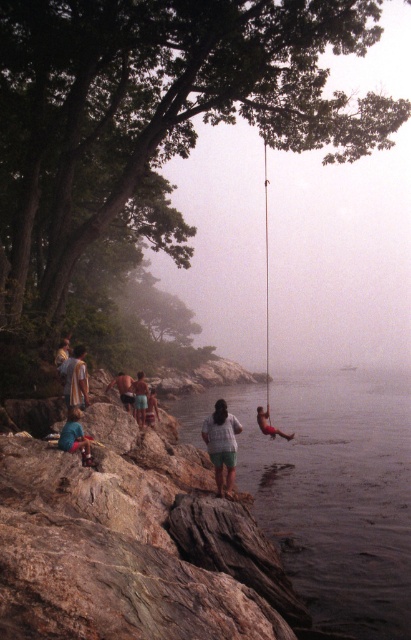
Question: Which object is positioned closest to the brown textured shorts at center?

Choices:
 (A) transparent water at swing right
 (B) green fabric shorts at lower center
 (C) orange fabric person at center
 (D) green fabric shorts at center

Answer: (B)

Question: Is transparent water at swing right bigger than green fabric shorts at lower center?

Choices:
 (A) yes
 (B) no

Answer: (A)

Question: Is transparent water at swing right below green fabric shorts at lower center?

Choices:
 (A) yes
 (B) no

Answer: (A)

Question: Which point is farther to the camera?

Choices:
 (A) click(x=217, y=486)
 (B) click(x=129, y=376)

Answer: (B)

Question: Which point is farther to the camera?

Choices:
 (A) transparent water at swing right
 (B) white cotton shirt at left

Answer: (B)

Question: Is brown textured shorts at center positioned behind orange fabric person at center?

Choices:
 (A) yes
 (B) no

Answer: (B)